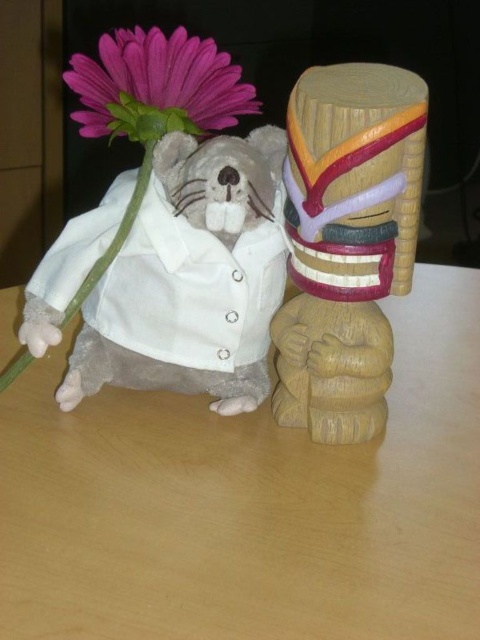
Does point (476, 595) come in front of point (218, 113)?

Yes, point (476, 595) is in front of point (218, 113).

Can you confirm if wooden table at center is positioned to the left of purple matte flower at upper left?

In fact, wooden table at center is to the right of purple matte flower at upper left.

Measure the distance between wooden table at center and camera.

wooden table at center is 29.95 inches from camera.

The height and width of the screenshot is (640, 480). I want to click on wooden table at center, so click(x=250, y=502).

The image size is (480, 640). Describe the element at coordinates (191, 278) in the screenshot. I see `fluffy gray teddy bear at left` at that location.

Does fluffy gray teddy bear at left have a greater height compared to purple matte flower at upper left?

Yes.

Which is in front, point (202, 292) or point (137, 124)?

Point (137, 124) is in front.

At what (x,y) coordinates should I click in order to perform the action: click on fluffy gray teddy bear at left. Please return your answer as a coordinate pair (x, y). Image resolution: width=480 pixels, height=640 pixels. Looking at the image, I should click on (191, 278).

Consider the image. Is wooden mask at center above purple matte flower at upper left?

Actually, wooden mask at center is below purple matte flower at upper left.

Which is behind, point (359, 212) or point (132, 108)?

Point (132, 108)

Describe the element at coordinates (347, 243) in the screenshot. I see `wooden mask at center` at that location.

Locate an element on the screen. The image size is (480, 640). wooden mask at center is located at coordinates (347, 243).